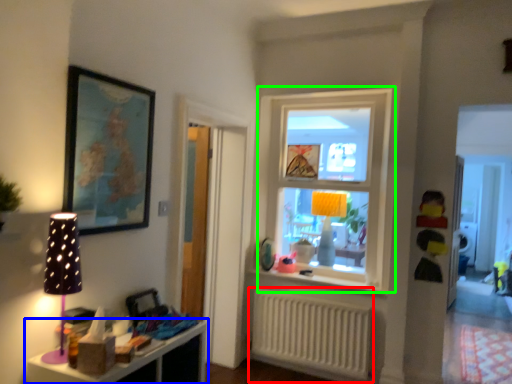
Question: Based on their relative distances, which object is farther from radiator (highlighted by a red box)? Choose from shelf (highlighted by a blue box) and window (highlighted by a green box).

Choices:
 (A) shelf
 (B) window

Answer: (A)